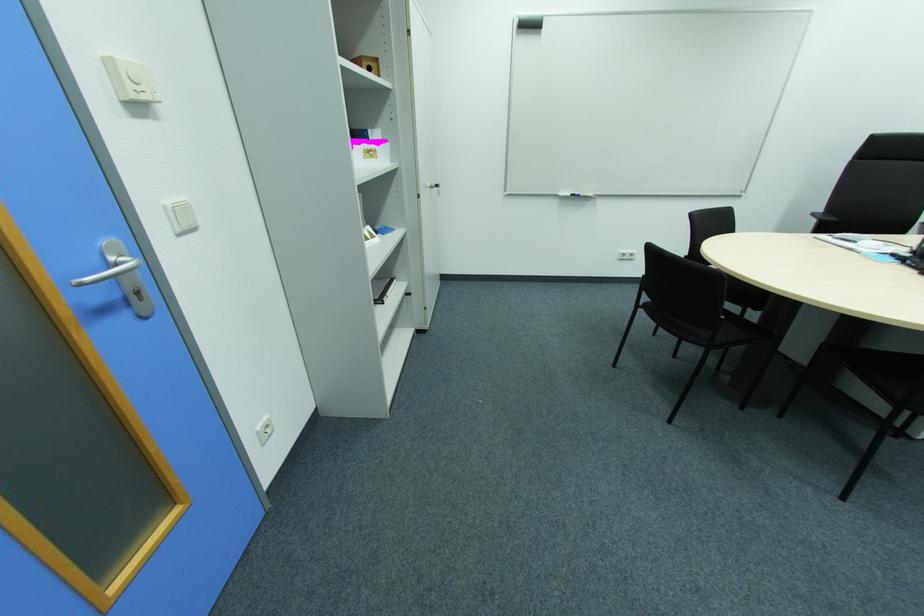
You are a GUI agent. You are given a task and a screenshot of the screen. Output one action in this format:
    pyautogui.click(x=<x>, y=<y>)
    Task: Click on the thermostat control dial
    Image resolution: width=924 pixels, height=616 pixels.
    Given the screenshot: What is the action you would take?
    pyautogui.click(x=130, y=79)